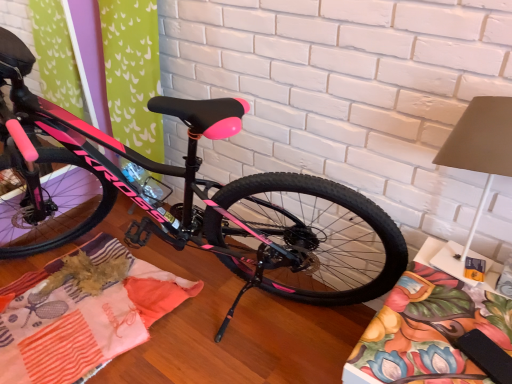
This screenshot has width=512, height=384. I want to click on vacant space to the right of patchwork fabric at center, which is counted as the second blanket, starting from the right, so click(x=227, y=322).